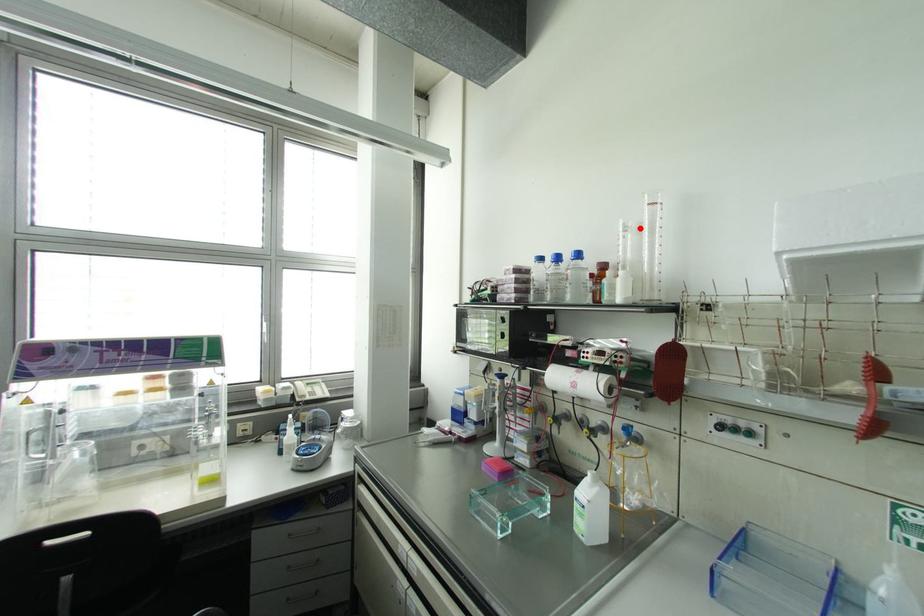
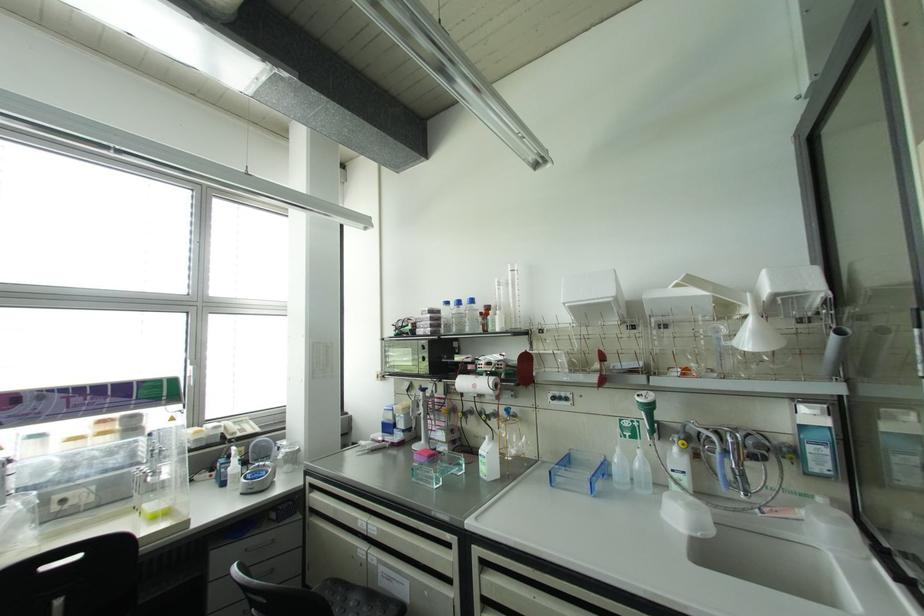
Locate, in the second image, the point that corresponds to the highlighted location in the first image.

(506, 284)